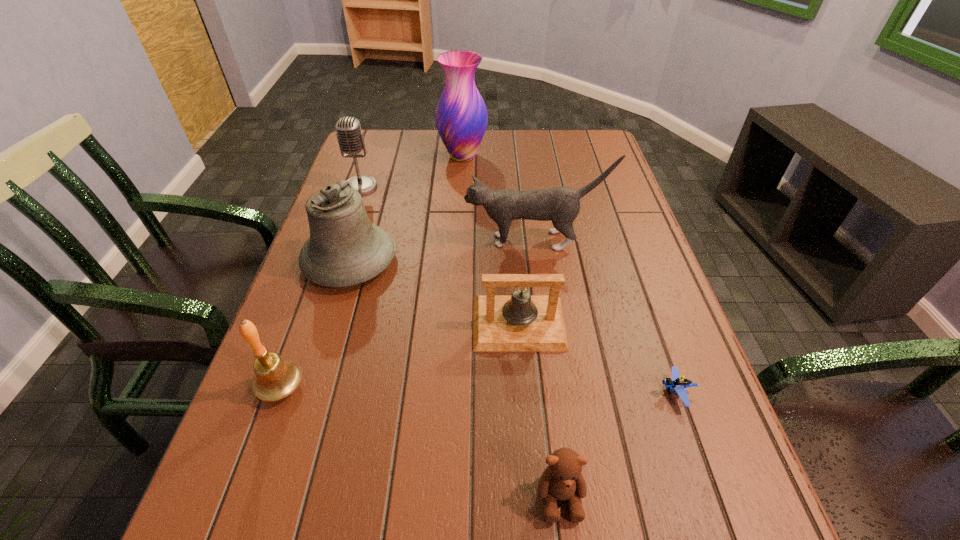
Locate an element on the screen. The image size is (960, 540). Lego is located at coordinates (678, 383).

What are the coordinates of `the rightmost object` in the screenshot? It's located at (678, 383).

The width and height of the screenshot is (960, 540). Identify the location of vacant region located 0.110m on the left of the farthest object. (403, 156).

This screenshot has width=960, height=540. Identify the location of vacant area situated 0.180m at the face of the cat. (394, 240).

Locate an element on the screen. The height and width of the screenshot is (540, 960). free space located at the face of the cat is located at coordinates point(366,240).

The width and height of the screenshot is (960, 540). Find the location of `free space located at the face of the cat`. free space located at the face of the cat is located at coordinates [442, 240].

The width and height of the screenshot is (960, 540). What are the coordinates of `vacant space located on the front of the farthest bell` in the screenshot? It's located at (296, 439).

Image resolution: width=960 pixels, height=540 pixels. I want to click on free space located 0.310m on the back of the microphone, so click(x=380, y=129).

Identify the location of vacant area located on the front of the nearest bell. (249, 477).

Where is `free space located on the back of the third shortest object`? This screenshot has width=960, height=540. free space located on the back of the third shortest object is located at coordinates (509, 196).